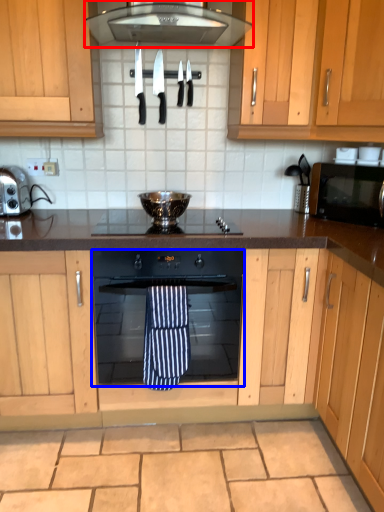
Question: Among these objects, which one is nearest to the camera, home appliance (highlighted by a red box) or oven (highlighted by a blue box)?

Choices:
 (A) home appliance
 (B) oven

Answer: (A)